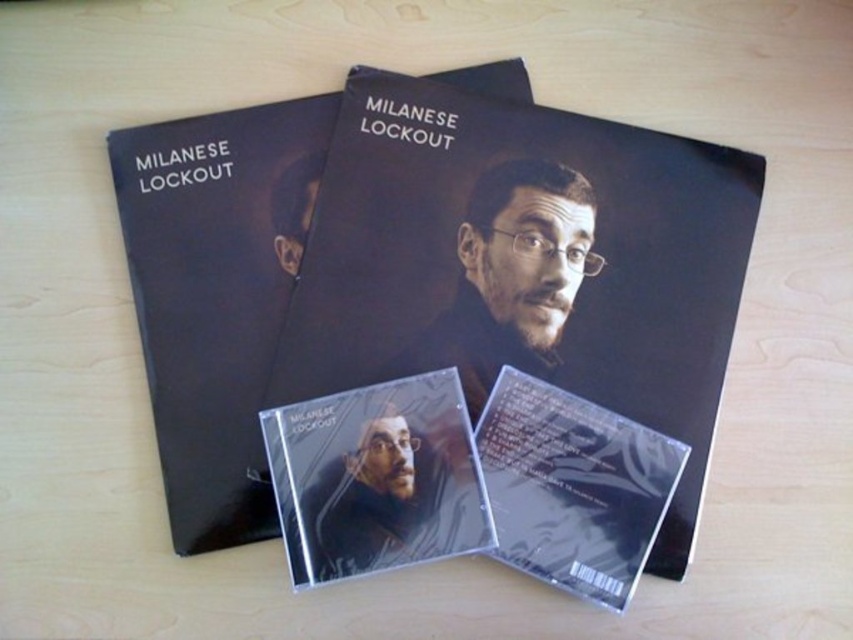
Does matte black album at center have a greater height compared to transparent plastic cd case at center?

Yes, matte black album at center is taller than transparent plastic cd case at center.

Describe the element at coordinates (525, 262) in the screenshot. The height and width of the screenshot is (640, 853). I see `matte black album at center` at that location.

Find the location of a particular element. The width and height of the screenshot is (853, 640). matte black album at center is located at coordinates (525, 262).

Is matte black album at center wider than black matte album at center?

Yes.

I want to click on matte black album at center, so click(525, 262).

From the picture: Between transparent plastic cd case at center and transparent plastic cd at center, which one appears on the right side from the viewer's perspective?

Positioned to the right is transparent plastic cd at center.

Is transparent plastic cd case at center bigger than transparent plastic cd at center?

No, transparent plastic cd case at center is not bigger than transparent plastic cd at center.

Between point (375, 472) and point (599, 525), which one is positioned in front?

Point (599, 525) is more forward.

Where is `transparent plastic cd case at center`? transparent plastic cd case at center is located at coordinates (376, 477).